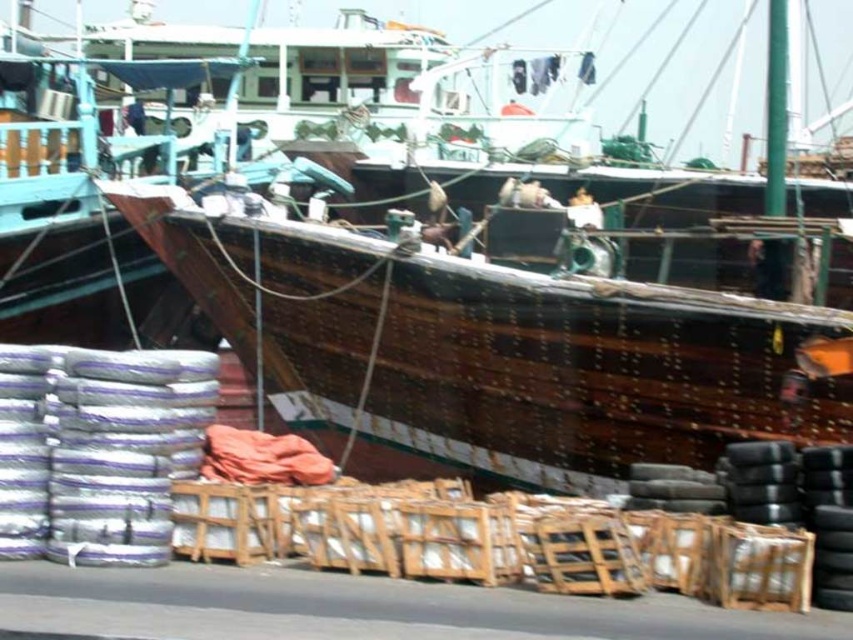
Question: Which object is farther from the camera taking this photo?

Choices:
 (A) wooden boat at center
 (B) black rubber tires at lower right

Answer: (A)

Question: Is wooden boat at center above black rubber tires at lower right?

Choices:
 (A) yes
 (B) no

Answer: (A)

Question: Does wooden boat at center come behind black rubber tires at lower right?

Choices:
 (A) yes
 (B) no

Answer: (A)

Question: Can you confirm if wooden boat at center is positioned to the right of black rubber tires at lower right?

Choices:
 (A) yes
 (B) no

Answer: (B)

Question: Which point is closer to the camera?

Choices:
 (A) wooden boat at center
 (B) black rubber tires at lower right

Answer: (B)